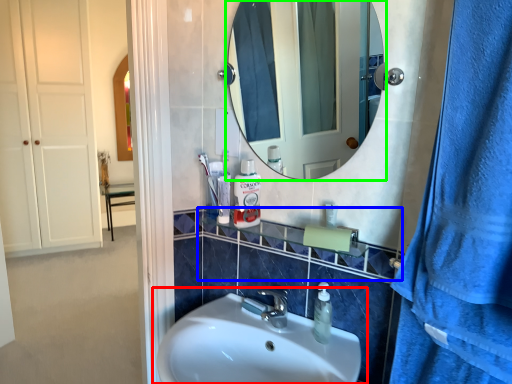
Question: Which object is the farthest from sink (highlighted by a red box)? Choose among these: balustrade (highlighted by a blue box) or mirror (highlighted by a green box).

Choices:
 (A) balustrade
 (B) mirror

Answer: (B)